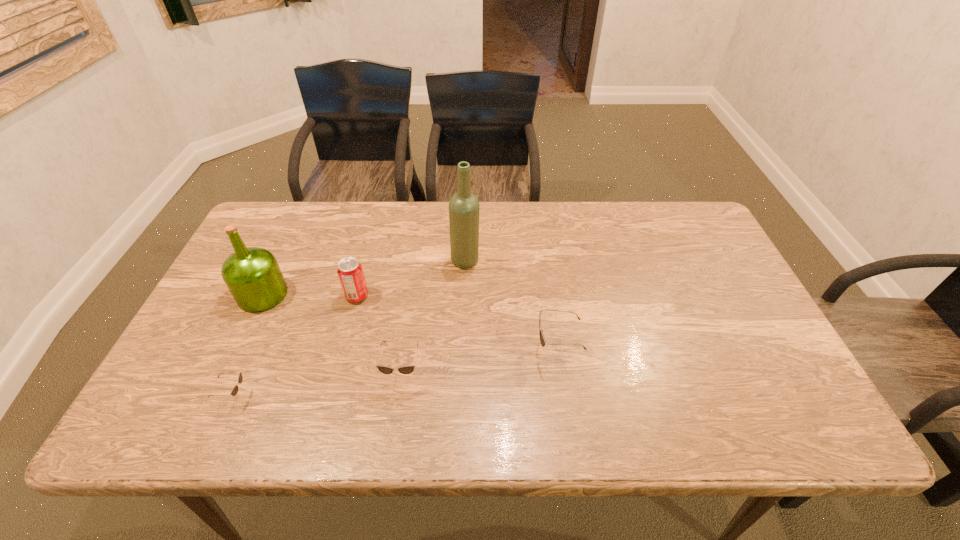
Please point out where to position a new sunglasses on the right to maintain spacing. Please provide its 2D coordinates. Your answer should be formatted as a tuple, i.e. [(x, y)], where the tuple contains the x and y coordinates of a point satisfying the conditions above.

[(700, 330)]